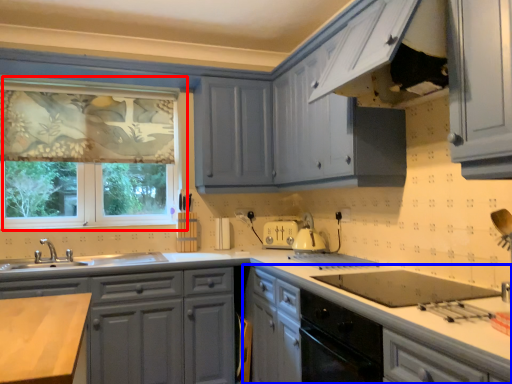
Question: Which point is closer to the camera, window (highlighted by a red box) or cabinetry (highlighted by a blue box)?

Choices:
 (A) window
 (B) cabinetry

Answer: (B)